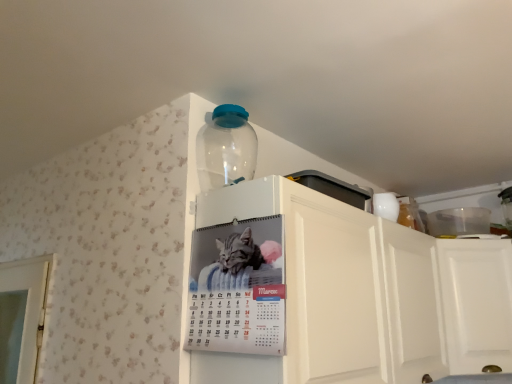
Question: From a real-world perspective, is transparent plastic bottle at upper center under metallic silver calendar at upper center?

Choices:
 (A) yes
 (B) no

Answer: (B)

Question: Is transparent plastic bottle at upper center not close to metallic silver calendar at upper center?

Choices:
 (A) yes
 (B) no

Answer: (B)

Question: Is metallic silver calendar at upper center located within transparent plastic bottle at upper center?

Choices:
 (A) no
 (B) yes

Answer: (A)

Question: Is transparent plastic bottle at upper center wider than metallic silver calendar at upper center?

Choices:
 (A) yes
 (B) no

Answer: (A)

Question: Considering the relative sizes of transparent plastic bottle at upper center and metallic silver calendar at upper center in the image provided, is transparent plastic bottle at upper center taller than metallic silver calendar at upper center?

Choices:
 (A) no
 (B) yes

Answer: (A)

Question: Considering their positions, is transparent plastic bottle at upper center located in front of or behind white matte cabinet at upper center?

Choices:
 (A) behind
 (B) front

Answer: (A)

Question: Would you say transparent plastic bottle at upper center is inside or outside white matte cabinet at upper center?

Choices:
 (A) outside
 (B) inside

Answer: (A)

Question: In terms of width, does transparent plastic bottle at upper center look wider or thinner when compared to white matte cabinet at upper center?

Choices:
 (A) thin
 (B) wide

Answer: (A)

Question: Does point (254, 140) appear closer or farther from the camera than point (426, 301)?

Choices:
 (A) farther
 (B) closer

Answer: (B)

Question: Considering the positions of metallic silver calendar at upper center and transparent plastic bottle at upper center in the image, is metallic silver calendar at upper center bigger or smaller than transparent plastic bottle at upper center?

Choices:
 (A) big
 (B) small

Answer: (B)

Question: Is metallic silver calendar at upper center to the left or to the right of transparent plastic bottle at upper center in the image?

Choices:
 (A) left
 (B) right

Answer: (B)

Question: Is metallic silver calendar at upper center spatially inside transparent plastic bottle at upper center, or outside of it?

Choices:
 (A) inside
 (B) outside

Answer: (B)

Question: Is metallic silver calendar at upper center taller or shorter than transparent plastic bottle at upper center?

Choices:
 (A) tall
 (B) short

Answer: (A)

Question: Does point (408, 311) appear closer or farther from the camera than point (225, 150)?

Choices:
 (A) farther
 (B) closer

Answer: (A)

Question: From the image's perspective, is white matte cabinet at upper center above or below transparent plastic bottle at upper center?

Choices:
 (A) below
 (B) above

Answer: (A)